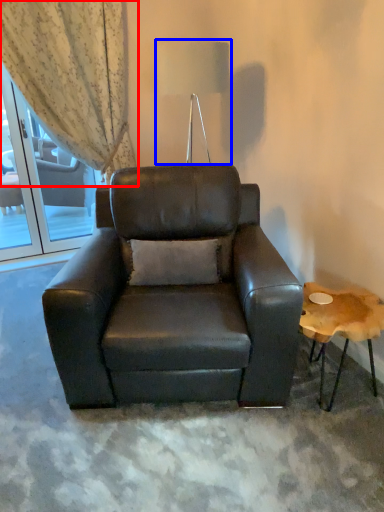
Question: Which object appears closest to the camera in this image, curtain (highlighted by a red box) or table lamp (highlighted by a blue box)?

Choices:
 (A) curtain
 (B) table lamp

Answer: (B)